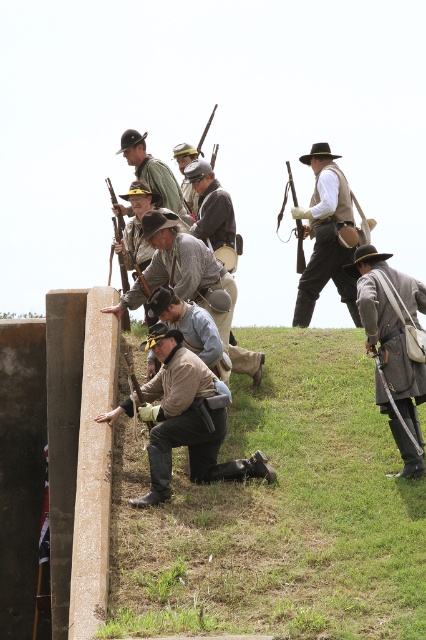
Between brown leather boots at lower center and wooden rifle at center, which one appears on the left side from the viewer's perspective?

brown leather boots at lower center is more to the left.

Between brown leather boots at lower center and wooden rifle at center, which one is positioned higher?

wooden rifle at center is above.

Between point (161, 440) and point (298, 262), which one is positioned in front?

Point (161, 440)

Locate an element on the screen. The height and width of the screenshot is (640, 426). brown leather boots at lower center is located at coordinates (181, 417).

Is gray wool coat at lower right taller than brown leather hat at center?

Indeed, gray wool coat at lower right has a greater height compared to brown leather hat at center.

Can you confirm if gray wool coat at lower right is bigger than brown leather hat at center?

Indeed, gray wool coat at lower right has a larger size compared to brown leather hat at center.

This screenshot has width=426, height=640. Describe the element at coordinates (394, 346) in the screenshot. I see `gray wool coat at lower right` at that location.

What are the coordinates of `gray wool coat at lower right` in the screenshot? It's located at click(394, 346).

Can you confirm if matte brown leather hat at upper center is thinner than wooden rifle at upper left?

Result: No, matte brown leather hat at upper center is not thinner than wooden rifle at upper left.

Can you confirm if matte brown leather hat at upper center is taller than wooden rifle at upper left?

Indeed, matte brown leather hat at upper center has a greater height compared to wooden rifle at upper left.

Who is more distant from viewer, (x=348, y=211) or (x=109, y=186)?

Positioned behind is point (x=109, y=186).

Identify the location of matte brown leather hat at upper center. (327, 236).